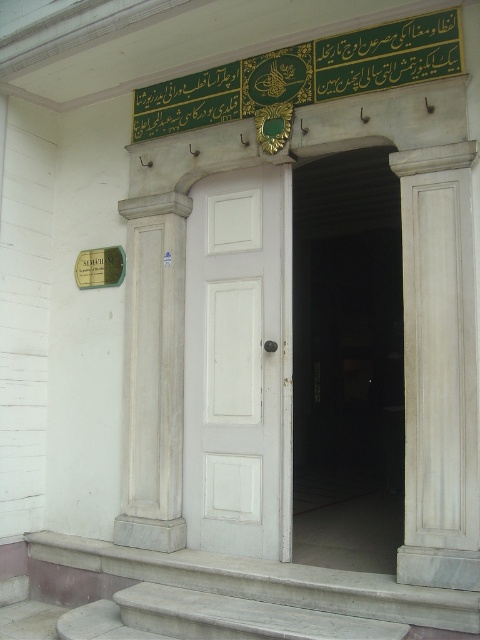
You are standing at the entrance of the building and want to reach a point that is exactly 4.18 meters away from you. Can you confirm if the point at coordinates point (204, 490) is the correct location?

The distance of point (204, 490) from viewer is 4.18 meters, so yes, the point at coordinates point (204, 490) is exactly 4.18 meters away from you.

You are standing at the entrance of a place of worship with a slightly ajar white door. You notice two points marked on the entrance area. The first point is at coordinates point [180,621] and the second is at point [88,280]. If you were to walk towards the building, which point would you encounter first?

Point [180,621] is in front of point [88,280], so you would encounter point [180,621] first as you walk towards the building.